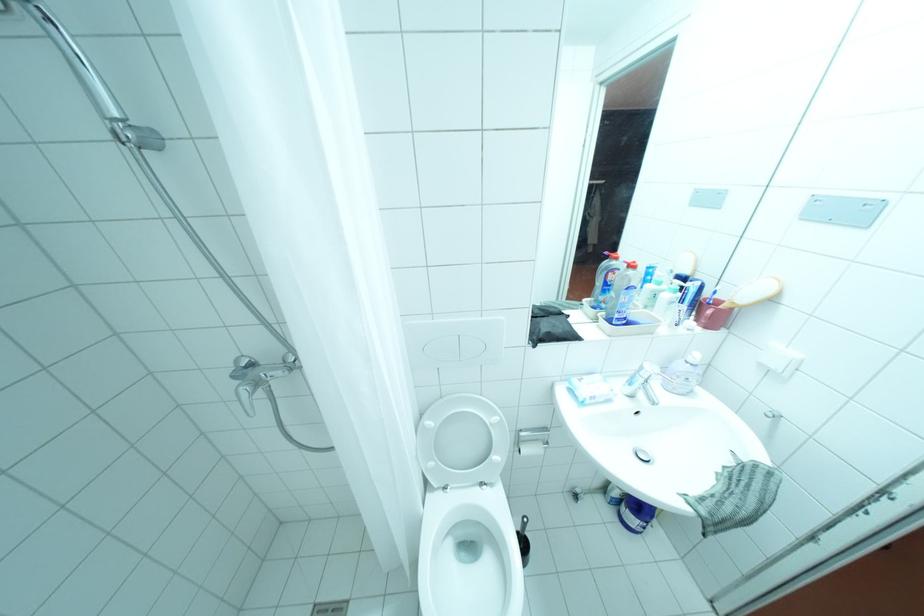
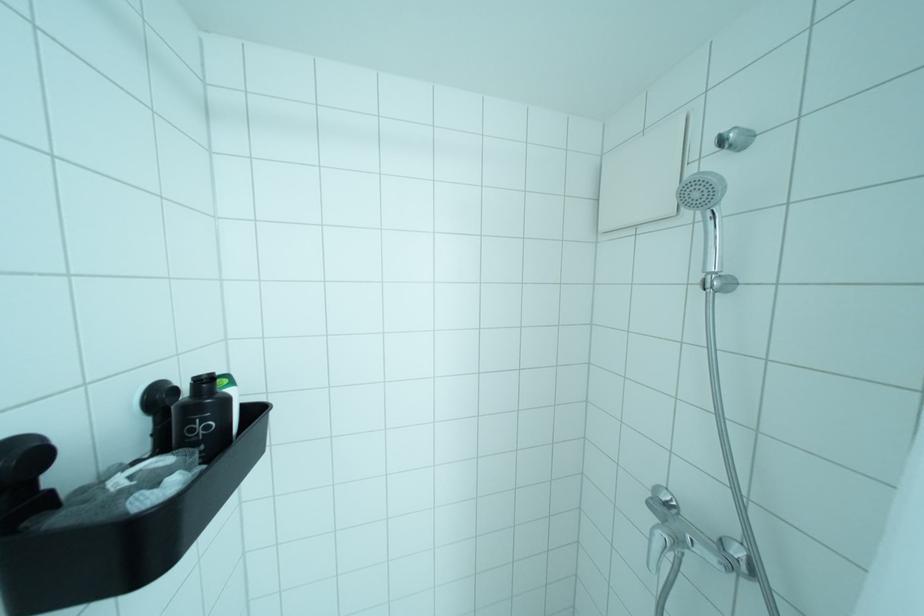
Question: The camera is either moving clockwise (left) or counter-clockwise (right) around the object. The first image is from the beginning of the video and the second image is from the end. Is the camera moving left or right when shooting the video?

Choices:
 (A) Left
 (B) Right

Answer: (B)